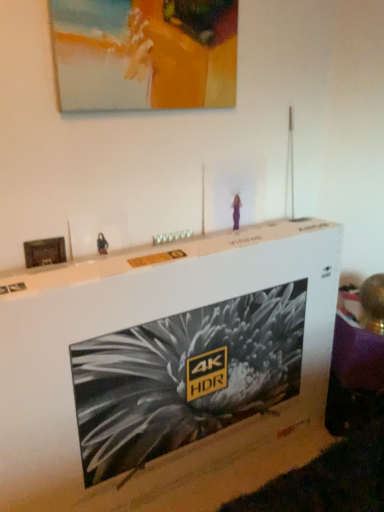
Question: Is matte acrylic painting at upper center, marked as the 1th picture frame in a right-to-left arrangement, shorter than white cardboard box at center?

Choices:
 (A) yes
 (B) no

Answer: (A)

Question: Does matte acrylic painting at upper center, marked as the 1th picture frame in a right-to-left arrangement, appear on the right side of white cardboard box at center?

Choices:
 (A) yes
 (B) no

Answer: (B)

Question: Is matte acrylic painting at upper center, positioned as the second picture frame in bottom-to-top order, smaller than white cardboard box at center?

Choices:
 (A) yes
 (B) no

Answer: (A)

Question: Is white cardboard box at center located within matte acrylic painting at upper center, the 2th picture frame in the left-to-right sequence?

Choices:
 (A) no
 (B) yes

Answer: (A)

Question: Is matte acrylic painting at upper center, marked as the 1th picture frame in a right-to-left arrangement, outside white cardboard box at center?

Choices:
 (A) yes
 (B) no

Answer: (A)

Question: Does matte acrylic painting at upper center, marked as the 1th picture frame in a right-to-left arrangement, lie in front of white cardboard box at center?

Choices:
 (A) yes
 (B) no

Answer: (B)

Question: Is wooden frame at left, the second picture frame when ordered from right to left, not within white cardboard box at center?

Choices:
 (A) yes
 (B) no

Answer: (A)

Question: From the image's perspective, does wooden frame at left, which ranks as the 2th picture frame in top-to-bottom order, appear lower than white cardboard box at center?

Choices:
 (A) yes
 (B) no

Answer: (B)

Question: Does wooden frame at left, which is counted as the 1th picture frame, starting from the bottom, have a lesser width compared to white cardboard box at center?

Choices:
 (A) no
 (B) yes

Answer: (B)

Question: Are wooden frame at left, the 1th picture frame viewed from the left, and white cardboard box at center far apart?

Choices:
 (A) no
 (B) yes

Answer: (A)

Question: Is wooden frame at left, the second picture frame when ordered from right to left, taller than white cardboard box at center?

Choices:
 (A) no
 (B) yes

Answer: (A)

Question: Can you confirm if wooden frame at left, which ranks as the 2th picture frame in top-to-bottom order, is wider than white cardboard box at center?

Choices:
 (A) no
 (B) yes

Answer: (A)

Question: Does white cardboard box at center turn towards matte acrylic painting at upper center, the 2th picture frame in the left-to-right sequence?

Choices:
 (A) no
 (B) yes

Answer: (A)